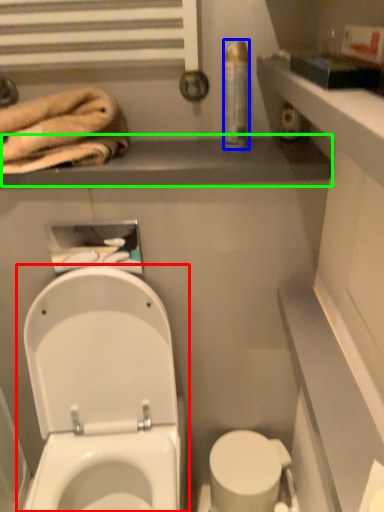
Question: Which is nearer to the toilet (highlighted by a red box)? toiletry (highlighted by a blue box) or balustrade (highlighted by a green box).

Choices:
 (A) toiletry
 (B) balustrade

Answer: (B)